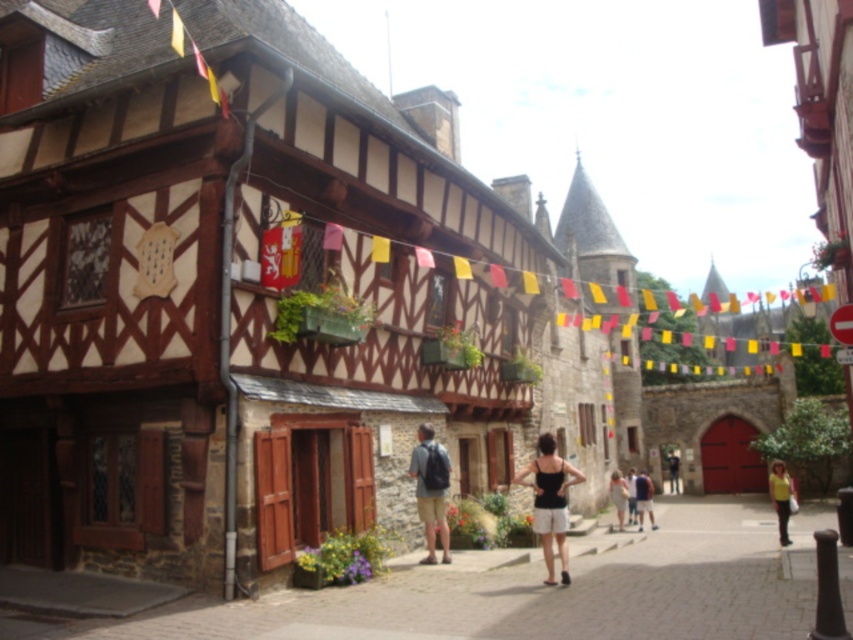
You are a tourist carrying a matte black backpack at center and want to place it on the stone paved alley at center. Will the backpack fit entirely on the alley without any part hanging off?

The stone paved alley at center is larger in size than matte black backpack at center, so yes, the backpack will fit entirely on the alley without any part hanging off.

You are standing on the street in front of the historic building. There is a point marked at coordinates (535, 593). Based on the scene description, what does this point most likely represent?

The point at coordinates (535, 593) most likely represents the stone paved alley at center.

You are standing at the entrance of the historic European town and want to walk to the center of the scene. According to the image, where should you head to find the stone paved alley at center?

The stone paved alley at center is located at the coordinates point (535, 593), so you should head towards that point to find it.